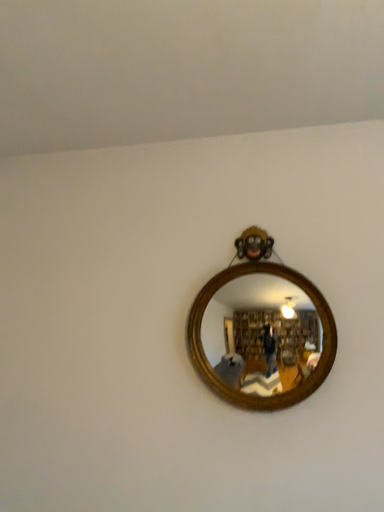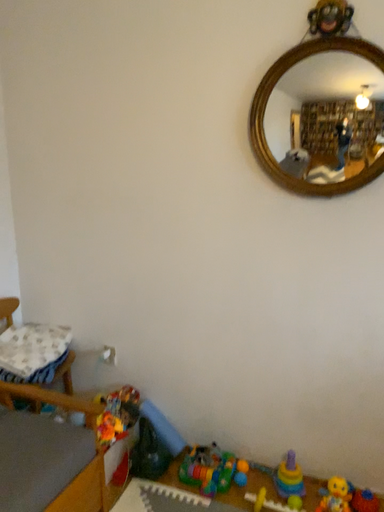
Question: How did the camera likely rotate when shooting the video?

Choices:
 (A) rotated downward
 (B) rotated upward

Answer: (A)